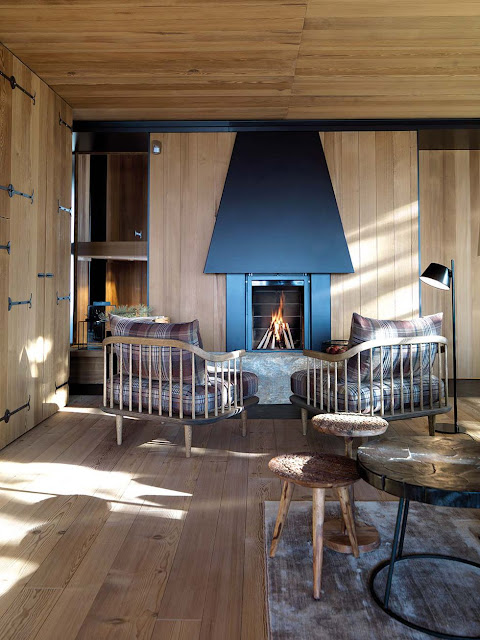
Image resolution: width=480 pixels, height=640 pixels. I want to click on cushioned chair, so click(371, 377), click(166, 374).